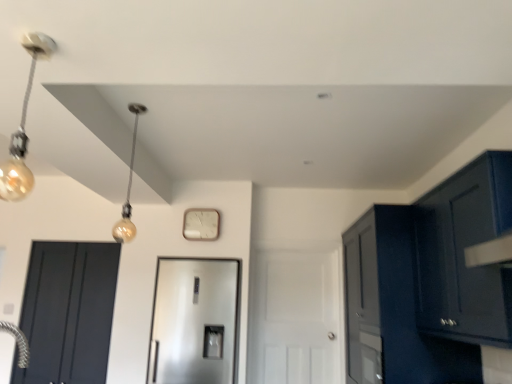
Identify the location of gold glass bulb at left. (23, 128).

The image size is (512, 384). What do you see at coordinates (23, 128) in the screenshot?
I see `gold glass bulb at left` at bounding box center [23, 128].

What do you see at coordinates (294, 318) in the screenshot?
I see `white matte door at center, the 3th door in the left-to-right sequence` at bounding box center [294, 318].

What do you see at coordinates (195, 321) in the screenshot?
I see `satin silver refrigerator at center, which is the second door from right to left` at bounding box center [195, 321].

This screenshot has width=512, height=384. What do you see at coordinates (128, 188) in the screenshot?
I see `matte gold bulb at upper left` at bounding box center [128, 188].

At what (x,y) coordinates should I click in order to perform the action: click on white matte clock at center. Please return your answer as a coordinate pair (x, y). Looking at the image, I should click on (201, 224).

What do you see at coordinates (68, 312) in the screenshot? The image size is (512, 384). I see `matte black door at left, the 1th door positioned from the left` at bounding box center [68, 312].

Where is `glossy dark blue cabinet at right, which is the 2th cabinetry in front-to-back order`? glossy dark blue cabinet at right, which is the 2th cabinetry in front-to-back order is located at coordinates (429, 281).

Considering the sizes of objects glossy dark blue cabinet at right, the 1th cabinetry from the back, and gold glass bulb at left in the image provided, who is bigger, glossy dark blue cabinet at right, the 1th cabinetry from the back, or gold glass bulb at left?

Bigger between the two is glossy dark blue cabinet at right, the 1th cabinetry from the back.

Considering the relative sizes of glossy dark blue cabinet at right, the 1th cabinetry from the back, and gold glass bulb at left in the image provided, is glossy dark blue cabinet at right, the 1th cabinetry from the back, wider than gold glass bulb at left?

Yes.

Between glossy dark blue cabinet at right, the 1th cabinetry from the back, and gold glass bulb at left, which one is positioned behind?

Positioned behind is glossy dark blue cabinet at right, the 1th cabinetry from the back.

Considering the relative positions of glossy dark blue cabinet at right, which is the 2th cabinetry in front-to-back order, and gold glass bulb at left in the image provided, is glossy dark blue cabinet at right, which is the 2th cabinetry in front-to-back order, to the left of gold glass bulb at left from the viewer's perspective?

In fact, glossy dark blue cabinet at right, which is the 2th cabinetry in front-to-back order, is to the right of gold glass bulb at left.

Considering the positions of objects matte gold bulb at upper left and matte black door at left, the 1th door positioned from the left, in the image provided, who is more to the left, matte gold bulb at upper left or matte black door at left, the 1th door positioned from the left,?

From the viewer's perspective, matte black door at left, the 1th door positioned from the left, appears more on the left side.

Where is `the 2nd door behind when counting from the matte gold bulb at upper left`? The height and width of the screenshot is (384, 512). the 2nd door behind when counting from the matte gold bulb at upper left is located at coordinates (68, 312).

From the image's perspective, between matte gold bulb at upper left and matte black door at left, the 1th door positioned from the left, who is located below?

matte black door at left, the 1th door positioned from the left, is shown below in the image.

Consider the image. How far apart are matte gold bulb at upper left and matte black door at left, the 3th door viewed from the right?

matte gold bulb at upper left and matte black door at left, the 3th door viewed from the right, are 29.27 inches apart from each other.

Considering the sizes of objects glossy dark blue cabinet at right, the 1th cabinetry from the back, and matte gold bulb at upper left in the image provided, who is thinner, glossy dark blue cabinet at right, the 1th cabinetry from the back, or matte gold bulb at upper left?

matte gold bulb at upper left.

Could you tell me if glossy dark blue cabinet at right, which is the 2th cabinetry in front-to-back order, is turned towards matte gold bulb at upper left?

Yes, glossy dark blue cabinet at right, which is the 2th cabinetry in front-to-back order, is oriented towards matte gold bulb at upper left.

From a real-world perspective, starting from the matte gold bulb at upper left, which cabinetry is the 2nd one below it? Please provide its 2D coordinates.

[(429, 281)]

Is point (490, 193) farther from viewer compared to point (126, 223)?

No, (490, 193) is in front of (126, 223).

Is gold glass bulb at left located within matte gold bulb at upper left?

No, matte gold bulb at upper left does not contain gold glass bulb at left.

Would you say matte gold bulb at upper left is a long distance from gold glass bulb at left?

That's right, there is a large distance between matte gold bulb at upper left and gold glass bulb at left.

Locate an element on the screen. Image resolution: width=512 pixels, height=384 pixels. light that appears above the gold glass bulb at left (from a real-world perspective) is located at coordinates (128, 188).

From the image's perspective, who appears lower, matte gold bulb at upper left or gold glass bulb at left?

matte gold bulb at upper left is shown below in the image.

Visually, is white matte clock at center positioned to the left or to the right of glossy dark blue cabinet at right, which is the 2th cabinetry in front-to-back order?

white matte clock at center is positioned on glossy dark blue cabinet at right, which is the 2th cabinetry in front-to-back order,'s left side.

Is white matte clock at center aimed at glossy dark blue cabinet at right, the 1th cabinetry from the back?

No, white matte clock at center is not aimed at glossy dark blue cabinet at right, the 1th cabinetry from the back.

Does point (187, 229) come behind point (428, 357)?

That is True.

From the image's perspective, between white matte clock at center and glossy dark blue cabinet at right, which is the 2th cabinetry in front-to-back order, which one is located above?

From the image's view, white matte clock at center is above.

Is matte gold bulb at upper left smaller than glossy dark blue cabinet at upper right, which is the first cabinetry from front to back?

Indeed, matte gold bulb at upper left has a smaller size compared to glossy dark blue cabinet at upper right, which is the first cabinetry from front to back.

How much distance is there between matte gold bulb at upper left and glossy dark blue cabinet at upper right, which is the first cabinetry from front to back?

matte gold bulb at upper left is 2.72 meters away from glossy dark blue cabinet at upper right, which is the first cabinetry from front to back.

From the image's perspective, is matte gold bulb at upper left located above glossy dark blue cabinet at upper right, which is the second cabinetry in back-to-front order?

Yes, from the image's perspective, matte gold bulb at upper left is on top of glossy dark blue cabinet at upper right, which is the second cabinetry in back-to-front order.

Is matte gold bulb at upper left not inside glossy dark blue cabinet at upper right, which is the second cabinetry in back-to-front order?

That's correct, matte gold bulb at upper left is outside of glossy dark blue cabinet at upper right, which is the second cabinetry in back-to-front order.

Considering the relative sizes of white matte door at center, the first door in the right-to-left sequence, and satin silver refrigerator at center, which is the second door from right to left, in the image provided, is white matte door at center, the first door in the right-to-left sequence, taller than satin silver refrigerator at center, which is the second door from right to left,?

Yes, white matte door at center, the first door in the right-to-left sequence, is taller than satin silver refrigerator at center, which is the second door from right to left.

From the image's perspective, is white matte door at center, the 3th door in the left-to-right sequence, located above or below satin silver refrigerator at center, which is the second door from right to left?

Based on their image positions, white matte door at center, the 3th door in the left-to-right sequence, is located above satin silver refrigerator at center, which is the second door from right to left.

In the scene shown: Is white matte door at center, the 3th door in the left-to-right sequence, smaller than satin silver refrigerator at center, which is the second door from right to left?

Yes, white matte door at center, the 3th door in the left-to-right sequence, is smaller than satin silver refrigerator at center, which is the second door from right to left.

What are the coordinates of `the 2nd cabinetry behind the gold glass bulb at left` in the screenshot? It's located at (429, 281).

You are a GUI agent. You are given a task and a screenshot of the screen. Output one action in this format:
    pyautogui.click(x=<x>, y=<y>)
    Task: Click on the door on the left of matte gold bulb at upper left
    
    Given the screenshot: What is the action you would take?
    pyautogui.click(x=68, y=312)

Based on their spatial positions, is matte black door at left, the 3th door viewed from the right, or white matte clock at center further from gold glass bulb at left?

matte black door at left, the 3th door viewed from the right, is positioned further to the anchor gold glass bulb at left.

Which object lies nearer to the anchor point white matte clock at center, gold glass bulb at left or matte black door at left, the 1th door positioned from the left?

matte black door at left, the 1th door positioned from the left, lies closer to white matte clock at center than the other object.

From the image, which object appears to be farther from glossy dark blue cabinet at upper right, which is the first cabinetry from front to back, matte black door at left, the 1th door positioned from the left, or matte gold bulb at upper left?

matte black door at left, the 1th door positioned from the left, is positioned further to the anchor glossy dark blue cabinet at upper right, which is the first cabinetry from front to back.

Looking at the image, which one is located further to gold glass bulb at left, white matte door at center, the first door in the right-to-left sequence, or glossy dark blue cabinet at right, the 1th cabinetry from the back?

white matte door at center, the first door in the right-to-left sequence, is further to gold glass bulb at left.

Based on their spatial positions, is white matte clock at center or glossy dark blue cabinet at right, the 1th cabinetry from the back, closer to matte black door at left, the 1th door positioned from the left?

Based on the image, white matte clock at center appears to be nearer to matte black door at left, the 1th door positioned from the left.

Based on their spatial positions, is white matte clock at center or glossy dark blue cabinet at right, which is the 2th cabinetry in front-to-back order, further from matte gold bulb at upper left?

glossy dark blue cabinet at right, which is the 2th cabinetry in front-to-back order, is positioned further to the anchor matte gold bulb at upper left.

Based on their spatial positions, is gold glass bulb at left or matte gold bulb at upper left closer to glossy dark blue cabinet at upper right, which is the first cabinetry from front to back?

Based on the image, gold glass bulb at left appears to be nearer to glossy dark blue cabinet at upper right, which is the first cabinetry from front to back.

Which object lies further to the anchor point satin silver refrigerator at center, placed as the second door when sorted from left to right, gold glass bulb at left or white matte clock at center?

Based on the image, gold glass bulb at left appears to be further to satin silver refrigerator at center, placed as the second door when sorted from left to right.

Image resolution: width=512 pixels, height=384 pixels. I want to click on cabinetry situated between matte black door at left, the 3th door viewed from the right, and glossy dark blue cabinet at upper right, which is the second cabinetry in back-to-front order, from left to right, so click(429, 281).

What are the coordinates of `clock located between matte black door at left, the 1th door positioned from the left, and glossy dark blue cabinet at upper right, which is the second cabinetry in back-to-front order, in the left-right direction` in the screenshot? It's located at (201, 224).

At what (x,y) coordinates should I click in order to perform the action: click on light situated between gold glass bulb at left and glossy dark blue cabinet at right, which is the 2th cabinetry in front-to-back order, from left to right. Please return your answer as a coordinate pair (x, y). This screenshot has height=384, width=512. Looking at the image, I should click on (128, 188).

Locate an element on the screen. light between gold glass bulb at left and satin silver refrigerator at center, placed as the second door when sorted from left to right, from front to back is located at coordinates (128, 188).